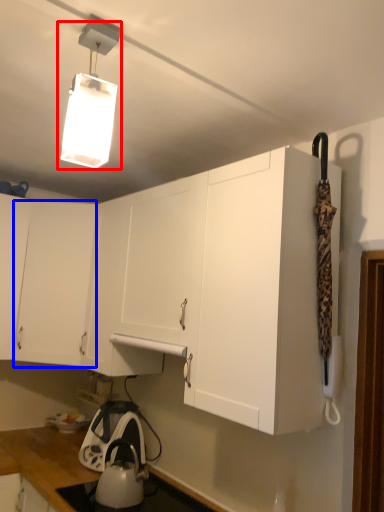
Question: Which object appears closest to the camera in this image, lamp (highlighted by a red box) or cabinetry (highlighted by a blue box)?

Choices:
 (A) lamp
 (B) cabinetry

Answer: (A)